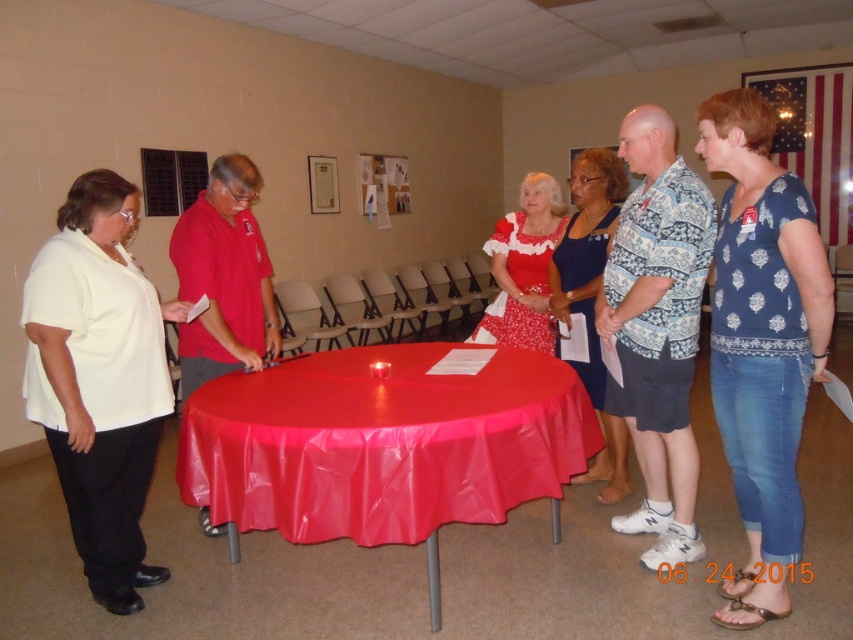
From the picture: Is shiny plastic tablecloth at center shorter than blue printed dress at center?

Yes.

Between shiny plastic tablecloth at center and blue printed dress at center, which one is positioned higher?

Positioned higher is blue printed dress at center.

Identify the location of shiny plastic tablecloth at center. (383, 445).

This screenshot has height=640, width=853. Find the location of `shiny plastic tablecloth at center`. shiny plastic tablecloth at center is located at coordinates (383, 445).

Between blue printed blouse at center and matte red dress at center, which one appears on the right side from the viewer's perspective?

blue printed blouse at center is more to the right.

Is blue printed blouse at center shorter than matte red dress at center?

No.

Which is behind, point (721, 618) or point (534, 250)?

Positioned behind is point (534, 250).

The image size is (853, 640). Identify the location of blue printed blouse at center. (762, 342).

Does shiny plastic tablecloth at center appear over blue printed blouse at center?

No, shiny plastic tablecloth at center is not above blue printed blouse at center.

Who is lower down, shiny plastic tablecloth at center or blue printed blouse at center?

Positioned lower is shiny plastic tablecloth at center.

This screenshot has width=853, height=640. In order to click on shiny plastic tablecloth at center in this screenshot , I will do `click(383, 445)`.